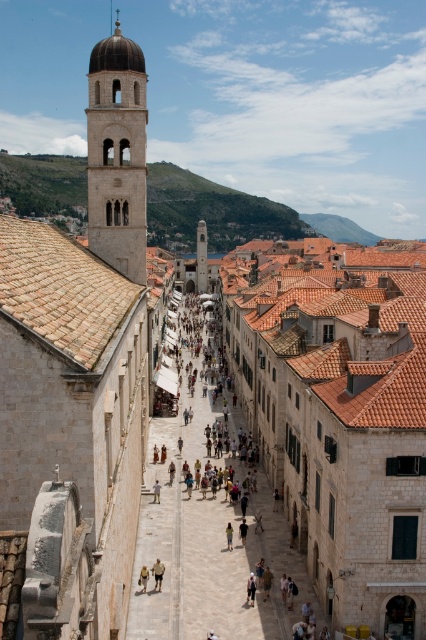
Question: Does smooth stone bell tower at center lie in front of light brown leather pants at center?

Choices:
 (A) no
 (B) yes

Answer: (A)

Question: Does light beige stone bell tower at upper left have a greater width compared to light beige shorts at center?

Choices:
 (A) yes
 (B) no

Answer: (A)

Question: Which of the following is the farthest from the observer?

Choices:
 (A) light brown fabric at center
 (B) light brown leather pants at center
 (C) smooth stone bell tower at center
 (D) light blue fabric person at center

Answer: (C)

Question: Based on their relative distances, which object is farther from the light beige stone alley at center?

Choices:
 (A) light blue fabric person at center
 (B) light beige stone bell tower at upper left
 (C) light brown leather pants at center

Answer: (B)

Question: Is smooth stone bell tower at center wider than light brown leather pants at center?

Choices:
 (A) no
 (B) yes

Answer: (B)

Question: Which point is farther from the camera taking this photo?

Choices:
 (A) (232, 538)
 (B) (158, 500)

Answer: (B)